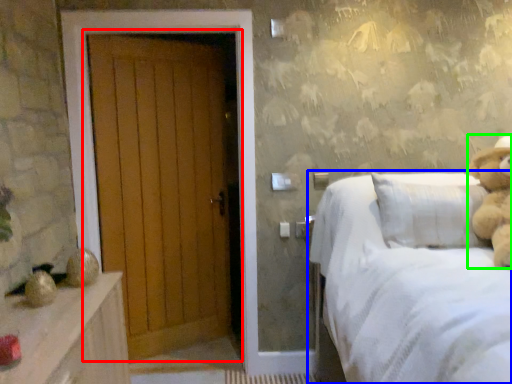
Question: Estimate the real-world distances between objects in this image. Which object is closer to door (highlighted by a red box), bed (highlighted by a blue box) or teddy bear (highlighted by a green box)?

Choices:
 (A) bed
 (B) teddy bear

Answer: (A)